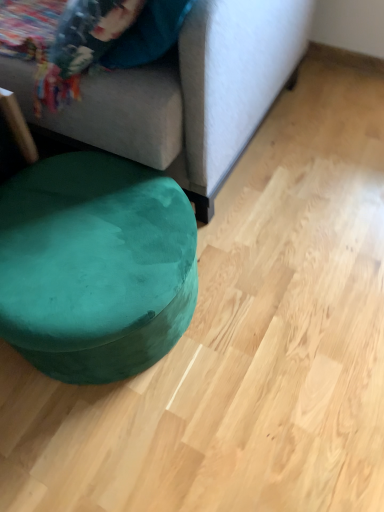
Question: Looking at the image, does velvet green bean bag at lower left seem bigger or smaller compared to suede gray couch at upper left?

Choices:
 (A) big
 (B) small

Answer: (B)

Question: Considering the positions of velvet green bean bag at lower left and suede gray couch at upper left in the image, is velvet green bean bag at lower left taller or shorter than suede gray couch at upper left?

Choices:
 (A) short
 (B) tall

Answer: (A)

Question: In terms of width, does velvet green bean bag at lower left look wider or thinner when compared to suede gray couch at upper left?

Choices:
 (A) thin
 (B) wide

Answer: (A)

Question: Is suede gray couch at upper left taller or shorter than velvet green bean bag at lower left?

Choices:
 (A) short
 (B) tall

Answer: (B)

Question: From the image's perspective, is suede gray couch at upper left located above or below velvet green bean bag at lower left?

Choices:
 (A) below
 (B) above

Answer: (B)

Question: In the image, is suede gray couch at upper left positioned in front of or behind velvet green bean bag at lower left?

Choices:
 (A) behind
 (B) front

Answer: (B)

Question: Do you think suede gray couch at upper left is within velvet green bean bag at lower left, or outside of it?

Choices:
 (A) outside
 (B) inside

Answer: (A)